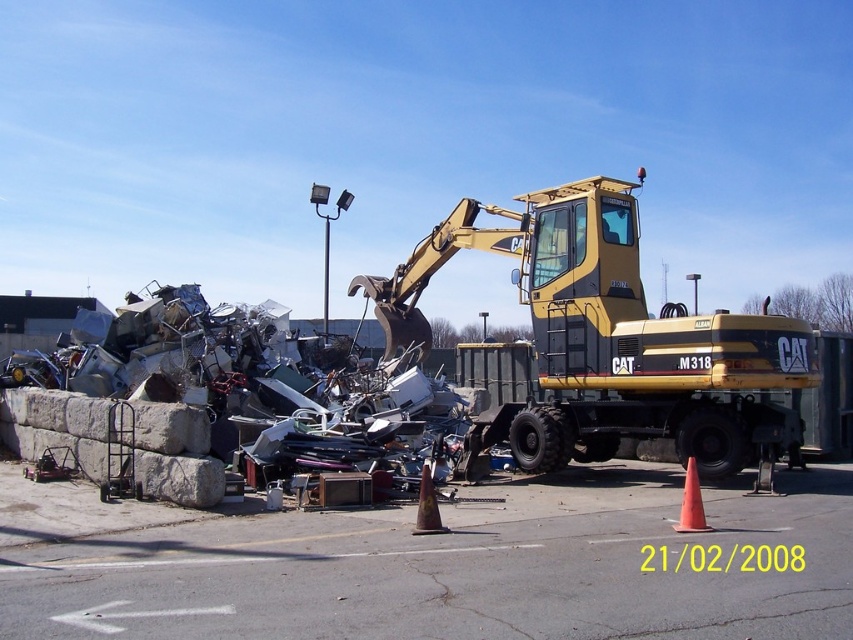
You are a construction worker who needs to place a new traffic cone on the site. You have two options available, the brown matte traffic cone at center and the orange matte traffic cone at lower right. Which cone would be more stable if placed on an uneven surface?

The brown matte traffic cone at center is taller than the orange matte traffic cone at lower right, so it might be less stable on an uneven surface. The orange matte traffic cone at lower right is shorter and therefore more stable.